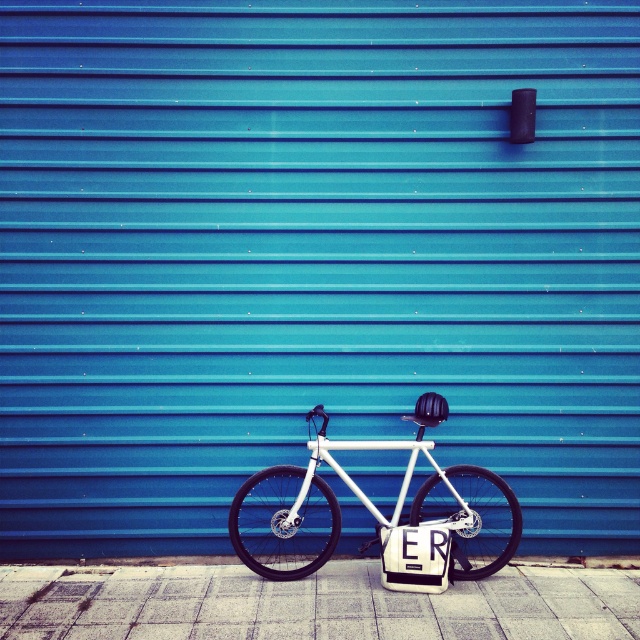
You are a delivery person who needs to place a package on the gray concrete pavement at lower center. The package is 15 inches long. Can you place the package on the pavement without it overlapping the white matte bicycle at center?

The gray concrete pavement at lower center is 14.49 inches from the white matte bicycle at center. Since the package is 15 inches long, it would overlap the white matte bicycle at center if placed on the pavement.

You are a delivery person who needs to park your white matte bicycle at center on the gray concrete pavement at lower center. Can the bicycle fit on the pavement if the pavement is wider than the bicycle?

The gray concrete pavement at lower center might be wider than white matte bicycle at center, so it is possible that the bicycle can fit on the pavement if the pavement is indeed wider. However, the exact dimensions are not provided, so further measurement would be needed to confirm.

Based on the photo, you are a delivery person who needs to park your bike on the gray concrete pavement at lower center. Currently, your white matte bicycle at center is blocking the path to the pavement. To move your bike to the pavement, which direction should you move it?

The gray concrete pavement at lower center is to the left of the white matte bicycle at center, so you should move the white matte bicycle at center to the left to reach the gray concrete pavement at lower center.